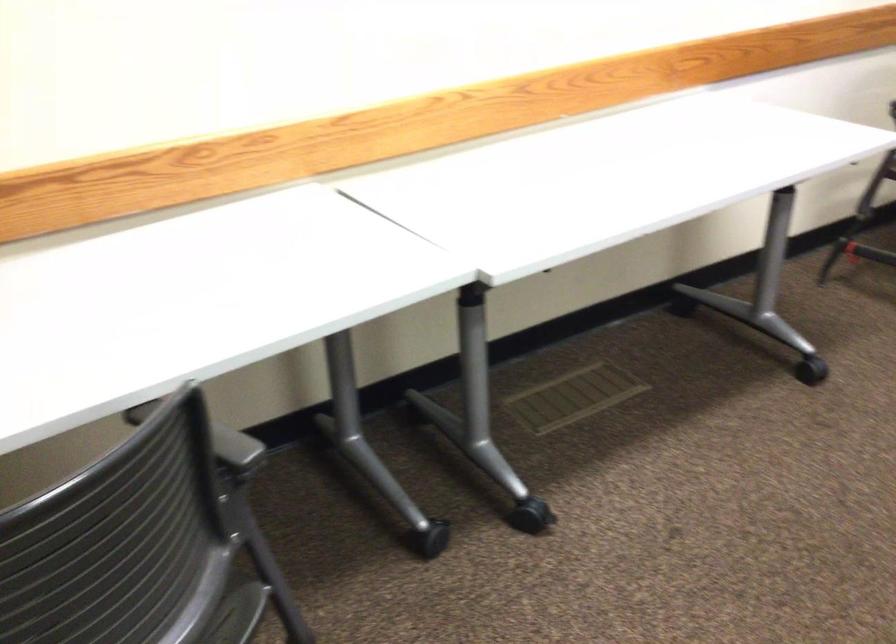
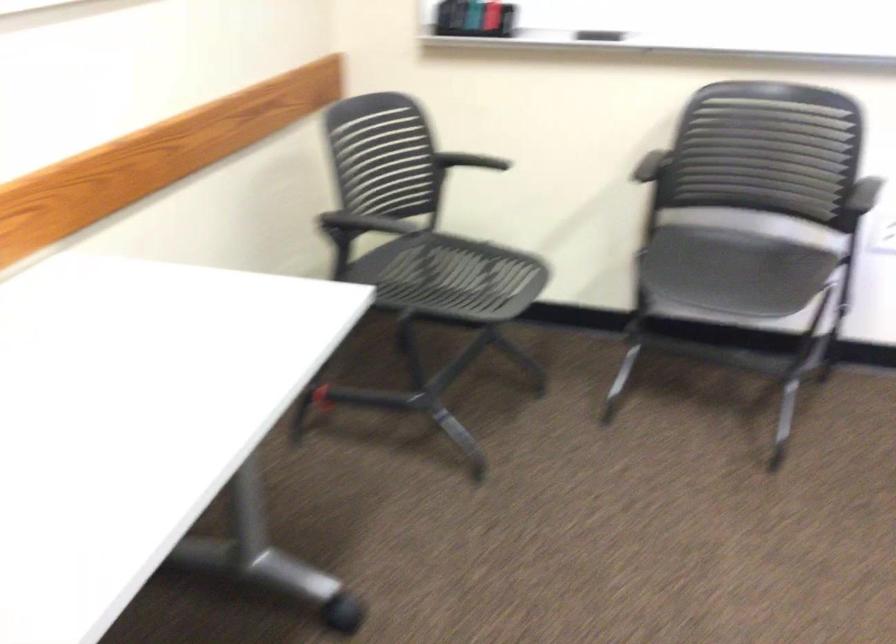
Question: The first image is from the beginning of the video and the second image is from the end. How did the camera likely rotate when shooting the video?

Choices:
 (A) Left
 (B) Right
 (C) Up
 (D) Down

Answer: (B)